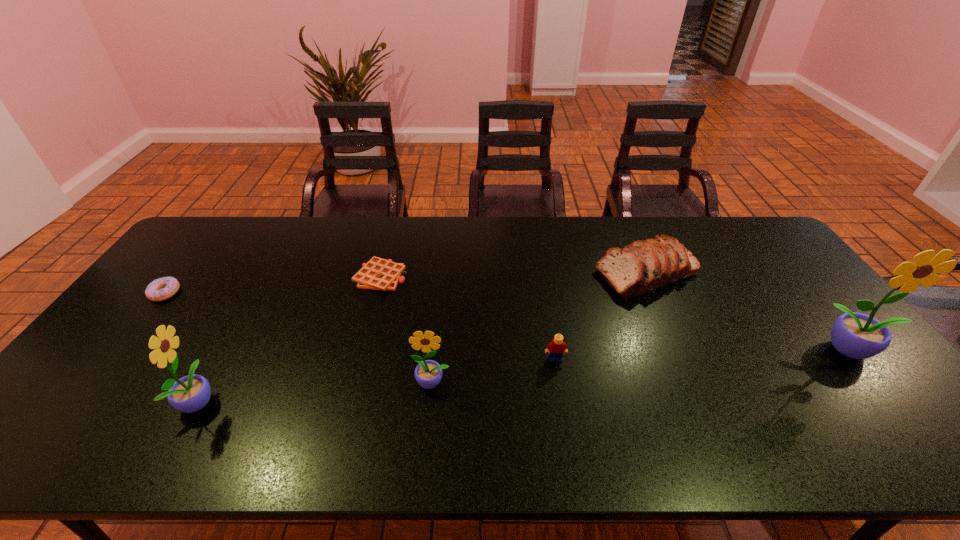
If equal spacing is desired by inserting an extra sunflower among them, please point out a free spot for this new sunflower. Please provide its 2D coordinates. Your answer should be formatted as a tuple, i.e. [(x, y)], where the tuple contains the x and y coordinates of a point satisfying the conditions above.

[(649, 366)]